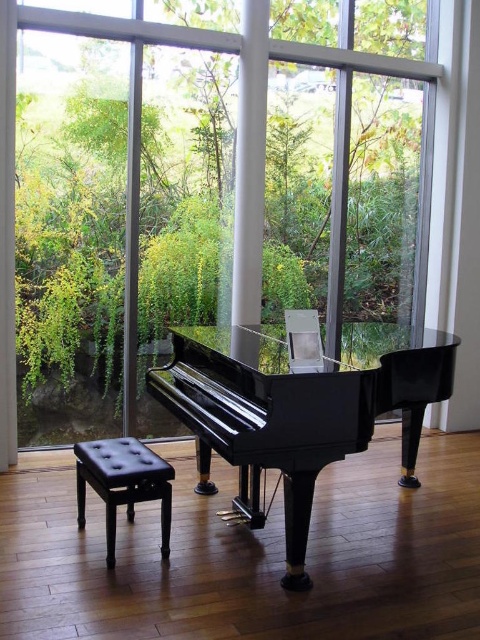
Is glossy black piano at center positioned before black leather stool at lower left?

Yes, glossy black piano at center is closer to the viewer.

Which is behind, point (409, 481) or point (98, 465)?

Positioned behind is point (409, 481).

You are a GUI agent. You are given a task and a screenshot of the screen. Output one action in this format:
    pyautogui.click(x=<x>, y=<y>)
    Task: Click on the glossy black piano at center
    The image size is (480, 640).
    Given the screenshot: What is the action you would take?
    pyautogui.click(x=299, y=417)

Based on the photo, which of these two, glossy black piano at center or transparent glass window at center, stands taller?

transparent glass window at center is taller.

Is glossy black piano at center positioned at the back of transparent glass window at center?

That is False.

The width and height of the screenshot is (480, 640). What do you see at coordinates (299, 417) in the screenshot?
I see `glossy black piano at center` at bounding box center [299, 417].

Find the location of a particular element. The image size is (480, 640). glossy black piano at center is located at coordinates (299, 417).

Does transparent glass window at center have a lesser width compared to black leather stool at lower left?

In fact, transparent glass window at center might be wider than black leather stool at lower left.

Who is higher up, transparent glass window at center or black leather stool at lower left?

transparent glass window at center is above.

In order to click on transparent glass window at center in this screenshot , I will do `click(137, 147)`.